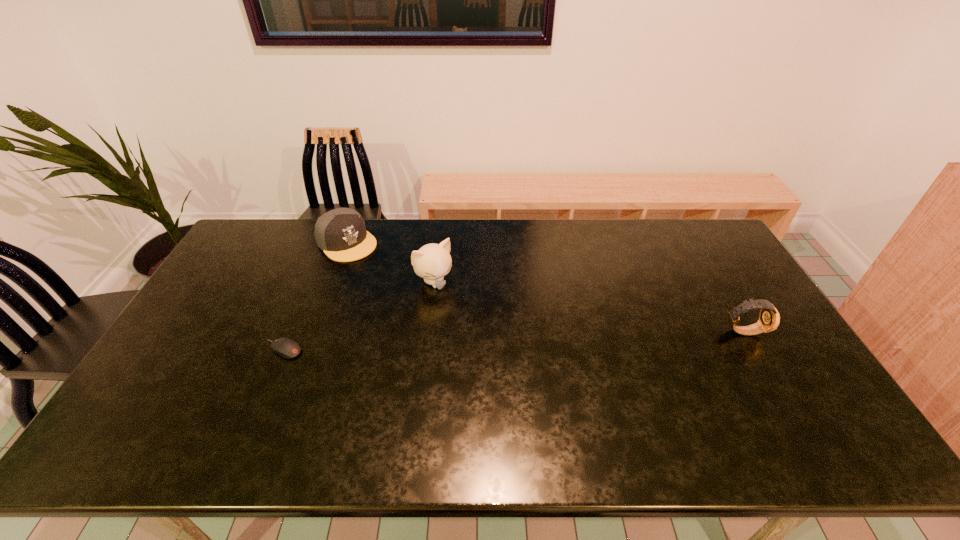
Find the location of a particular element. The width and height of the screenshot is (960, 540). blank region between the cap and the second farthest object is located at coordinates (391, 262).

Point out which object is positioned as the nearest to the farthest object. Please provide its 2D coordinates. Your answer should be formatted as a tuple, i.e. [(x, y)], where the tuple contains the x and y coordinates of a point satisfying the conditions above.

[(432, 262)]

Where is `the third closest object to the kitten`? This screenshot has width=960, height=540. the third closest object to the kitten is located at coordinates (769, 319).

You are a GUI agent. You are given a task and a screenshot of the screen. Output one action in this format:
    pyautogui.click(x=<x>, y=<y>)
    Task: Click on the free region that satisfies the following two spatial constraints: 1. on the front side of the farthest object; 2. on the right side of the third object from left to right
    The width and height of the screenshot is (960, 540).
    Given the screenshot: What is the action you would take?
    pyautogui.click(x=332, y=282)

Identify the location of free space that satisfies the following two spatial constraints: 1. on the front side of the second farthest object; 2. on the left side of the farthest object. pos(332,282).

I want to click on vacant position in the image that satisfies the following two spatial constraints: 1. on the front side of the third nearest object; 2. on the face of the watch, so click(x=429, y=331).

Locate an element on the screen. This screenshot has height=540, width=960. vacant area in the image that satisfies the following two spatial constraints: 1. on the front side of the kitten; 2. on the face of the watch is located at coordinates (429, 331).